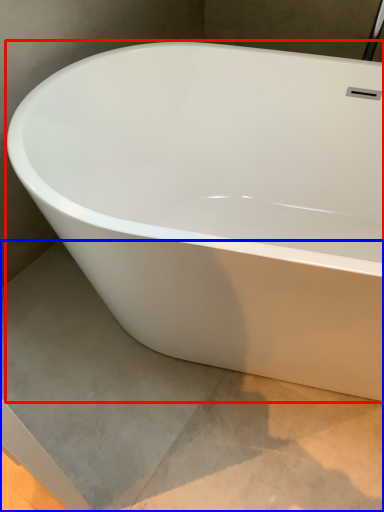
Question: Which of the following is the closest to the observer, bathtub (highlighted by a red box) or concrete (highlighted by a blue box)?

Choices:
 (A) bathtub
 (B) concrete

Answer: (A)